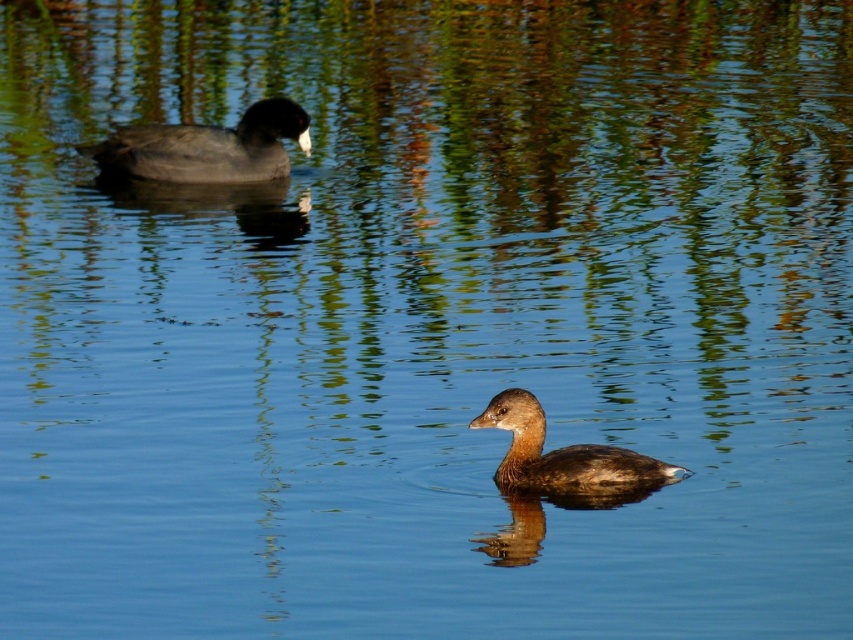
Question: Does dark gray matte duck at left appear on the left side of brown matte duck at center?

Choices:
 (A) no
 (B) yes

Answer: (B)

Question: Is dark gray matte duck at left smaller than brown matte duck at center?

Choices:
 (A) no
 (B) yes

Answer: (A)

Question: Which of the following is the farthest from the observer?

Choices:
 (A) (648, 483)
 (B) (292, 106)

Answer: (B)

Question: Is dark gray matte duck at left smaller than brown matte duck at center?

Choices:
 (A) no
 (B) yes

Answer: (A)

Question: Which point appears closest to the camera in this image?

Choices:
 (A) (605, 458)
 (B) (100, 148)

Answer: (A)